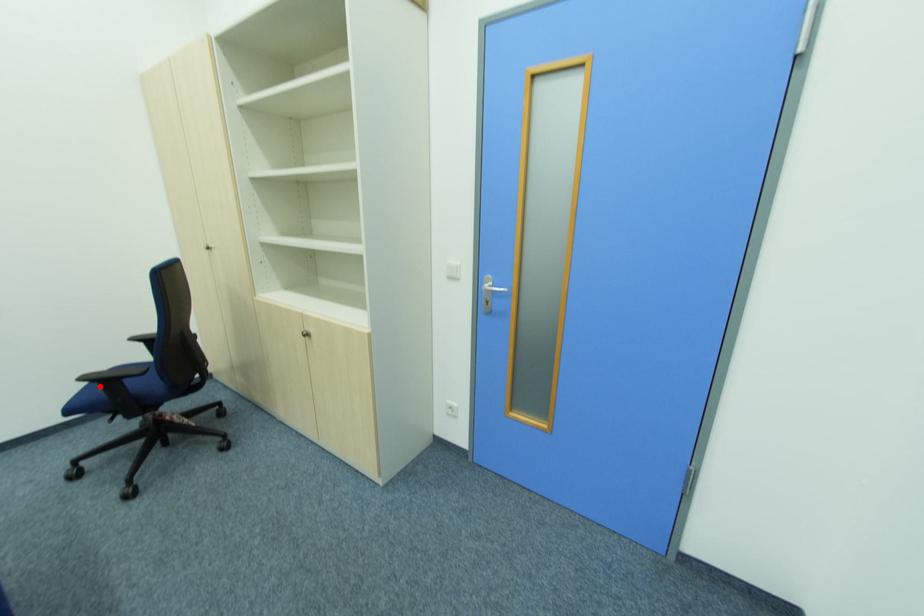
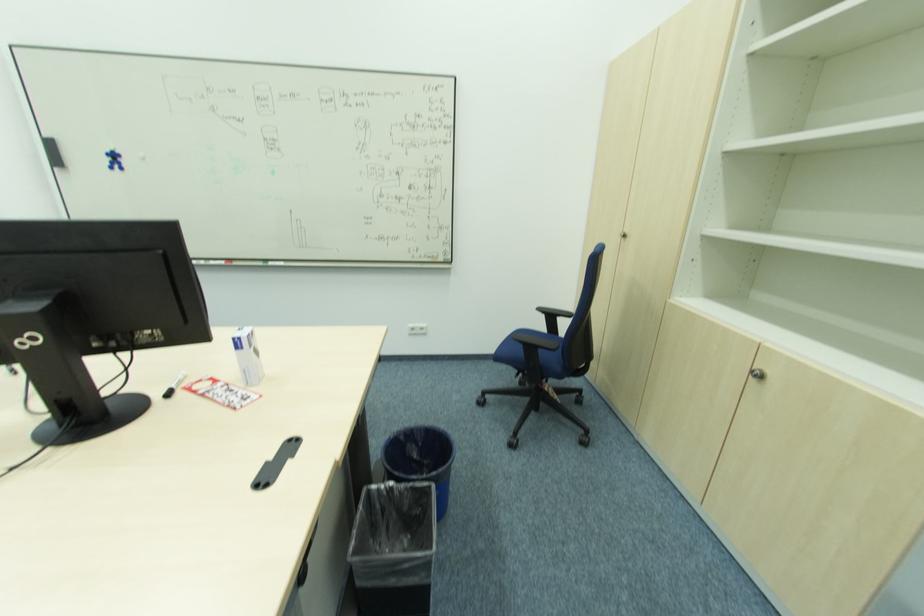
Question: I am providing you with two images of the same scene from different viewpoints. Given a red point in image1, look at the same physical point in image2. Is it:

Choices:
 (A) Closer to the viewpoint
 (B) Farther from the viewpoint

Answer: (B)